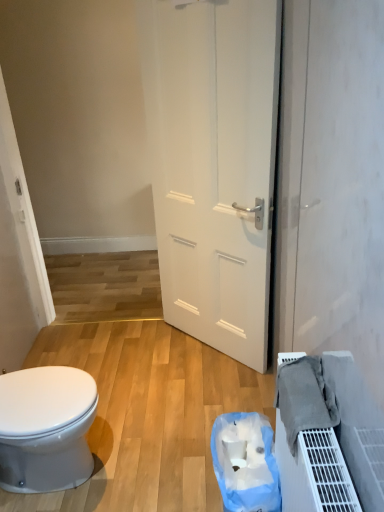
Question: Can you confirm if white matte door at center is wider than blue plastic bag at lower center?

Choices:
 (A) no
 (B) yes

Answer: (A)

Question: Is white matte door at center positioned beyond the bounds of blue plastic bag at lower center?

Choices:
 (A) no
 (B) yes

Answer: (B)

Question: Is white matte door at center smaller than blue plastic bag at lower center?

Choices:
 (A) yes
 (B) no

Answer: (B)

Question: Is white matte door at center behind blue plastic bag at lower center?

Choices:
 (A) yes
 (B) no

Answer: (A)

Question: Are white matte door at center and blue plastic bag at lower center far apart?

Choices:
 (A) no
 (B) yes

Answer: (B)

Question: Relative to gray fabric at lower right, is blue plastic bag at lower center in front or behind?

Choices:
 (A) behind
 (B) front

Answer: (A)

Question: Looking at the image, does blue plastic bag at lower center seem bigger or smaller compared to gray fabric at lower right?

Choices:
 (A) small
 (B) big

Answer: (B)

Question: Is blue plastic bag at lower center taller or shorter than gray fabric at lower right?

Choices:
 (A) tall
 (B) short

Answer: (A)

Question: From a real-world perspective, is blue plastic bag at lower center positioned above or below gray fabric at lower right?

Choices:
 (A) above
 (B) below

Answer: (B)

Question: Is white matte door at center inside the boundaries of blue plastic bag at lower center, or outside?

Choices:
 (A) inside
 (B) outside

Answer: (B)

Question: Is point (170, 54) positioned closer to the camera than point (211, 428)?

Choices:
 (A) closer
 (B) farther

Answer: (B)

Question: From the image's perspective, is white matte door at center positioned above or below blue plastic bag at lower center?

Choices:
 (A) below
 (B) above

Answer: (B)

Question: Is white matte door at center taller or shorter than blue plastic bag at lower center?

Choices:
 (A) short
 (B) tall

Answer: (B)

Question: From the image's perspective, relative to white matte door at center, is white glossy bidet at lower left above or below?

Choices:
 (A) below
 (B) above

Answer: (A)

Question: Is white glossy bidet at lower left taller or shorter than white matte door at center?

Choices:
 (A) tall
 (B) short

Answer: (B)